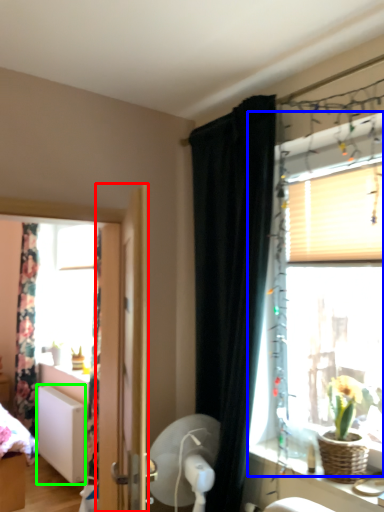
Question: Estimate the real-world distances between objects in this image. Which object is farther from door (highlighted by a red box), window (highlighted by a blue box) or radiator (highlighted by a green box)?

Choices:
 (A) window
 (B) radiator

Answer: (B)